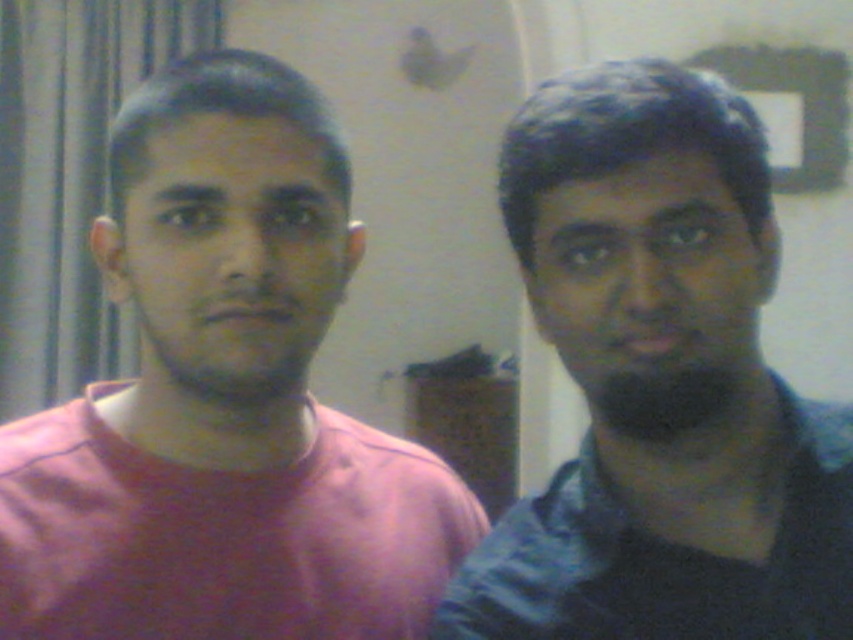
Question: Does dark blue shirt at right appear on the left side of dark matte beard at right?

Choices:
 (A) yes
 (B) no

Answer: (B)

Question: Does pink matte shirt at left have a smaller size compared to dark blue shirt at right?

Choices:
 (A) yes
 (B) no

Answer: (B)

Question: Is pink matte shirt at left bigger than dark matte beard at right?

Choices:
 (A) no
 (B) yes

Answer: (B)

Question: Among these objects, which one is farthest from the camera?

Choices:
 (A) pink matte shirt at left
 (B) dark matte beard at right
 (C) blue textured shirt at right
 (D) dark blue shirt at right

Answer: (A)

Question: Which point is farther to the camera?

Choices:
 (A) dark blue shirt at right
 (B) blue textured shirt at right

Answer: (B)

Question: Which of the following is the farthest from the observer?

Choices:
 (A) blue textured shirt at right
 (B) dark blue shirt at right
 (C) dark matte beard at right

Answer: (A)